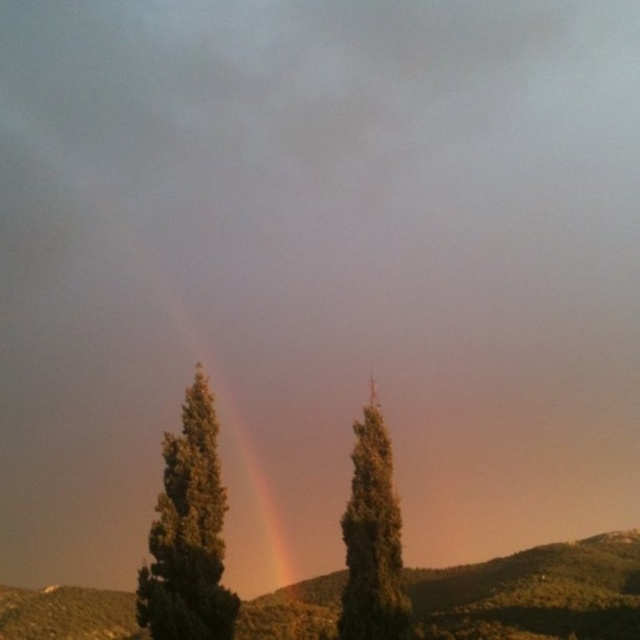
You are planning to plant a new tree between the green textured hill at lower center and the green textured tree at center. Given that the minimum required distance between two trees for healthy growth is 10 meters, will the proposed planting location meet this requirement?

The green textured hill at lower center and green textured tree at center are 11.45 meters apart from each other, which exceeds the minimum required distance of 10 meters. Therefore, the proposed planting location meets the requirement for healthy growth.

You are planning to build a small garden between the green textured hill at lower center and the green textured tree at center. Which area has more space for planting flowers?

The green textured hill at lower center is wider than the green textured tree at center, so there is more space for planting flowers on the green textured hill at lower center.

You are an artist trying to paint the landscape. You want to ensure the green textured tree at center is visible against the rainbow at center. Based on the scene, which object should you paint first to achieve this effect?

The green textured tree at center is in front of the rainbow at center, so you should paint the rainbow at center first and then paint the green textured tree at center on top of it to ensure visibility.